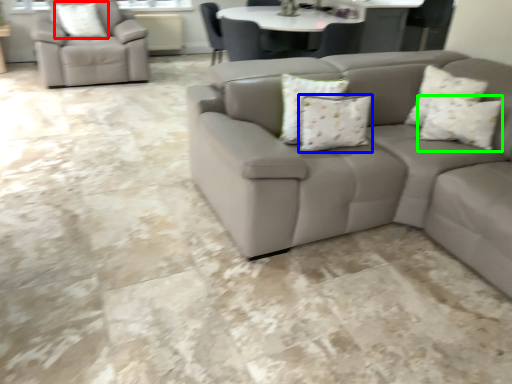
Question: Which object is positioned farthest from pillow (highlighted by a red box)? Select from pillow (highlighted by a blue box) and pillow (highlighted by a green box).

Choices:
 (A) pillow
 (B) pillow

Answer: (B)